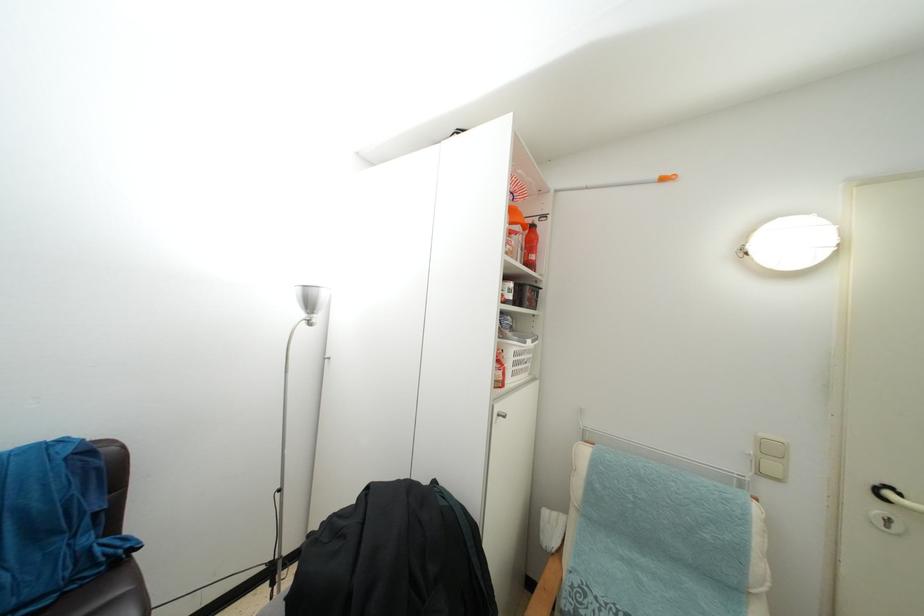
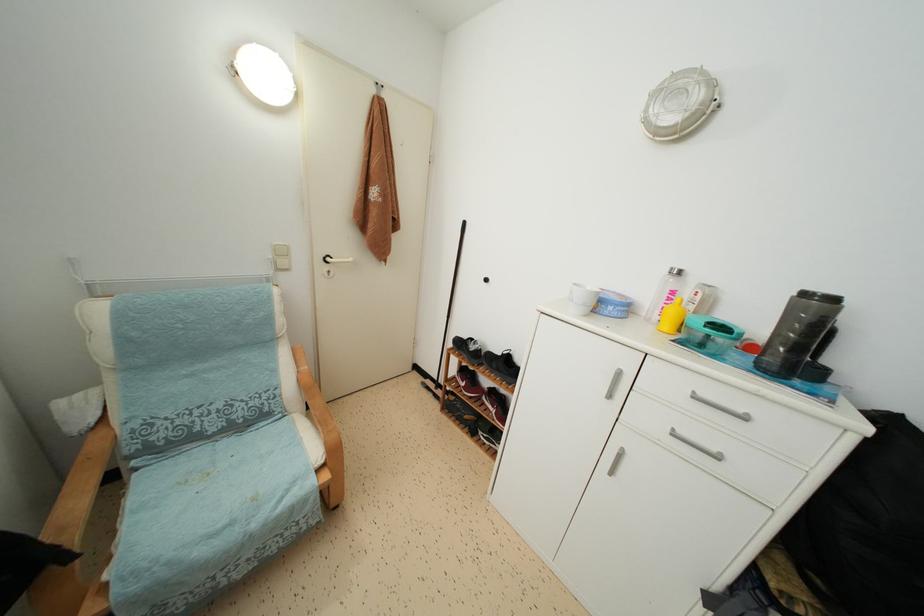
Find the pixel in the second image that matches point 881,493 in the first image.

(329, 264)